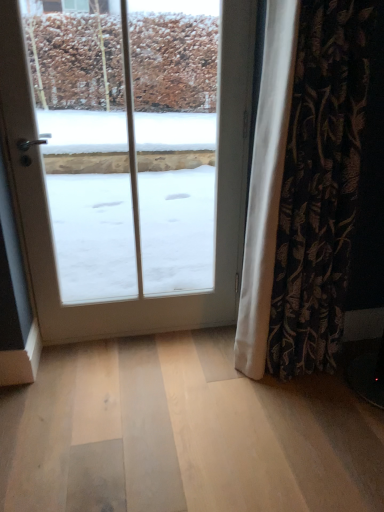
Question: From their relative heights in the image, would you say black floral fabric curtain at right is taller or shorter than white glass door at center?

Choices:
 (A) short
 (B) tall

Answer: (A)

Question: From a real-world perspective, is black floral fabric curtain at right positioned above or below white glass door at center?

Choices:
 (A) above
 (B) below

Answer: (B)

Question: From the image's perspective, is black floral fabric curtain at right above or below white glass door at center?

Choices:
 (A) above
 (B) below

Answer: (B)

Question: Looking at their shapes, would you say white glass door at center is wider or thinner than black floral fabric curtain at right?

Choices:
 (A) thin
 (B) wide

Answer: (A)

Question: Considering the positions of point (244, 31) and point (324, 218), is point (244, 31) closer or farther from the camera than point (324, 218)?

Choices:
 (A) closer
 (B) farther

Answer: (B)

Question: Is white glass door at center inside the boundaries of black floral fabric curtain at right, or outside?

Choices:
 (A) outside
 (B) inside

Answer: (A)

Question: Would you say white glass door at center is to the left or to the right of black floral fabric curtain at right in the picture?

Choices:
 (A) right
 (B) left

Answer: (B)